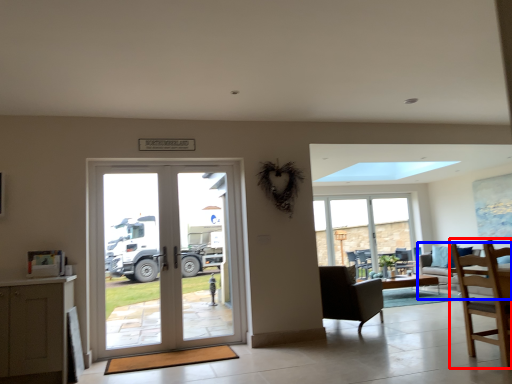
Question: Among these objects, which one is nearest to the camera, chair (highlighted by a red box) or studio couch (highlighted by a blue box)?

Choices:
 (A) chair
 (B) studio couch

Answer: (A)